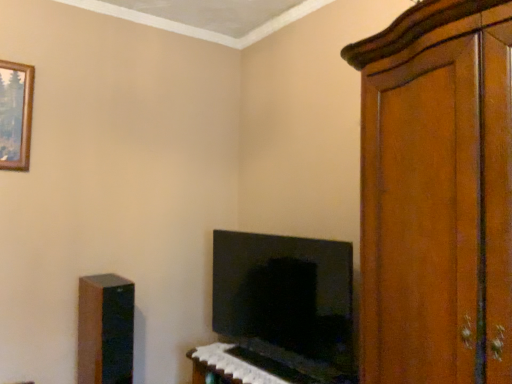
The height and width of the screenshot is (384, 512). In order to click on vacant area situated below matte black tv at center (from a real-world perspective) in this screenshot , I will do `click(254, 361)`.